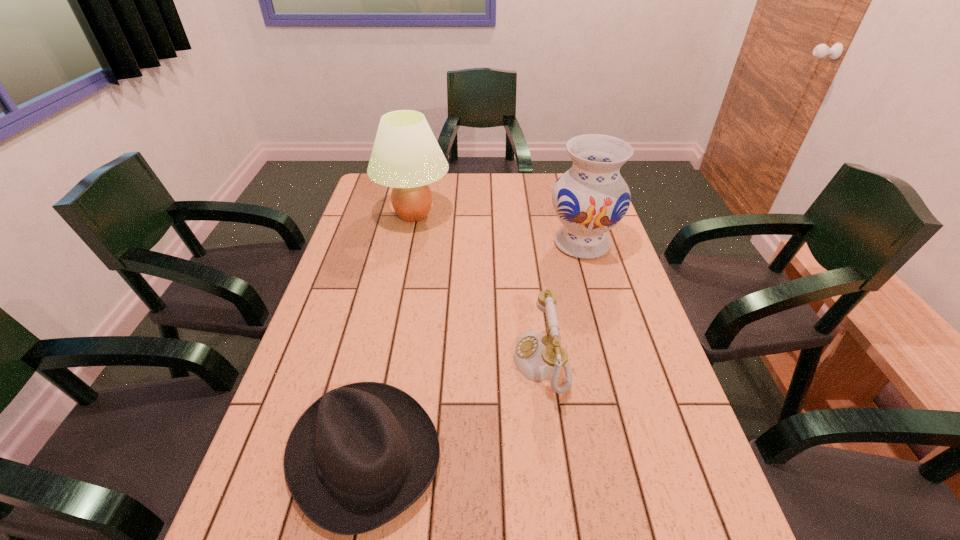
This screenshot has width=960, height=540. I want to click on lampshade, so click(406, 156).

Locate an element on the screen. the rightmost object is located at coordinates (589, 199).

Where is `the third object from left to right`? This screenshot has height=540, width=960. the third object from left to right is located at coordinates (536, 355).

The image size is (960, 540). I want to click on the second shortest object, so click(x=536, y=355).

You are a GUI agent. You are given a task and a screenshot of the screen. Output one action in this format:
    pyautogui.click(x=<x>, y=<y>)
    Task: Click on the vacant region located on the shade of the lampshade
    The width and height of the screenshot is (960, 540).
    Given the screenshot: What is the action you would take?
    pyautogui.click(x=498, y=215)

Locate an element on the screen. The image size is (960, 540). free region located on the back of the vase is located at coordinates (565, 186).

You are a GUI agent. You are given a task and a screenshot of the screen. Output one action in this format:
    pyautogui.click(x=<x>, y=<y>)
    Task: Click on the free point located on the dial of the third tallest object
    This screenshot has width=960, height=540.
    Given the screenshot: What is the action you would take?
    pyautogui.click(x=407, y=362)

You are a GUI agent. You are given a task and a screenshot of the screen. Output one action in this format:
    pyautogui.click(x=<x>, y=<y>)
    Task: Click on the free location located on the dial of the third tallest object
    
    Given the screenshot: What is the action you would take?
    pyautogui.click(x=396, y=362)

I want to click on vacant space located on the dial of the third tallest object, so click(x=403, y=362).

Identify the location of object that is positioned at the far edge. (406, 156).